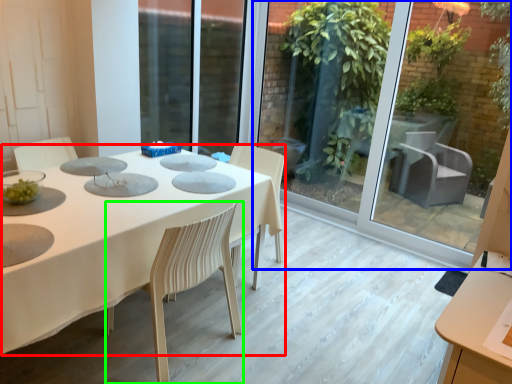
Question: Considering the real-world distances, which object is closest to table (highlighted by a red box)? glass door (highlighted by a blue box) or chair (highlighted by a green box).

Choices:
 (A) glass door
 (B) chair

Answer: (B)